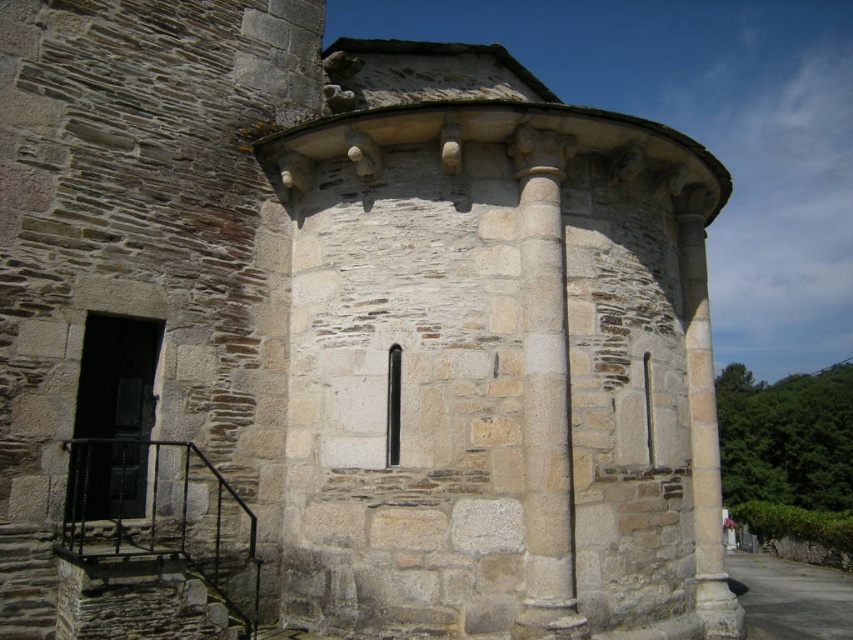
From the picture: You are standing at the entrance of the historic stone structure and want to reach the smooth stone column at center. Which direction should you move relative to the rustic stone staircase at lower left?

To reach the smooth stone column at center, you should move to the right of the rustic stone staircase at lower left since the smooth stone column at center is positioned to the right of it.

You are standing in front of the historic stone structure. There is a point marked at coordinates (544, 392). What object does this point correspond to?

The point corresponds to the smooth stone column at center.